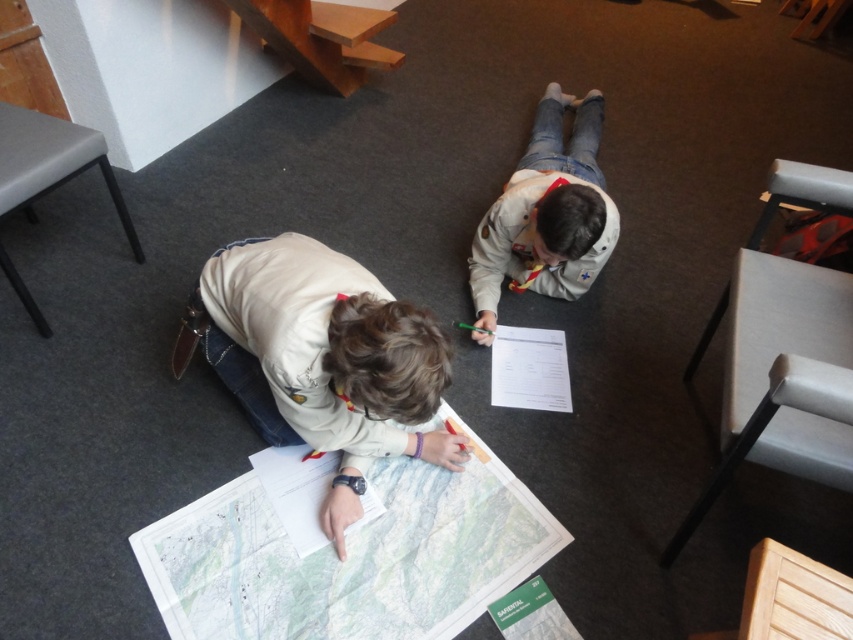
Which is below, white paper map at center or white matte jacket at lower left?

white paper map at center is lower down.

Which is above, white paper map at center or white matte jacket at lower left?

Positioned higher is white matte jacket at lower left.

Is point (250, 588) less distant than point (355, 508)?

Yes, point (250, 588) is closer to viewer.

This screenshot has width=853, height=640. Find the location of `white paper map at center`. white paper map at center is located at coordinates (350, 557).

Does white paper map at center have a greater height compared to white uniform at center?

No, white paper map at center is not taller than white uniform at center.

Is white paper map at center further to camera compared to white uniform at center?

No.

Measure the distance between white paper map at center and camera.

white paper map at center is 4.57 feet from camera.

Find the location of a particular element. The image size is (853, 640). white paper map at center is located at coordinates (350, 557).

How distant is white matte jacket at lower left from white uniform at center?

Answer: 28.18 inches

Which is below, white matte jacket at lower left or white uniform at center?

white matte jacket at lower left is lower down.

Locate an element on the screen. The image size is (853, 640). white matte jacket at lower left is located at coordinates (318, 358).

This screenshot has height=640, width=853. What are the coordinates of `white matte jacket at lower left` in the screenshot? It's located at (318, 358).